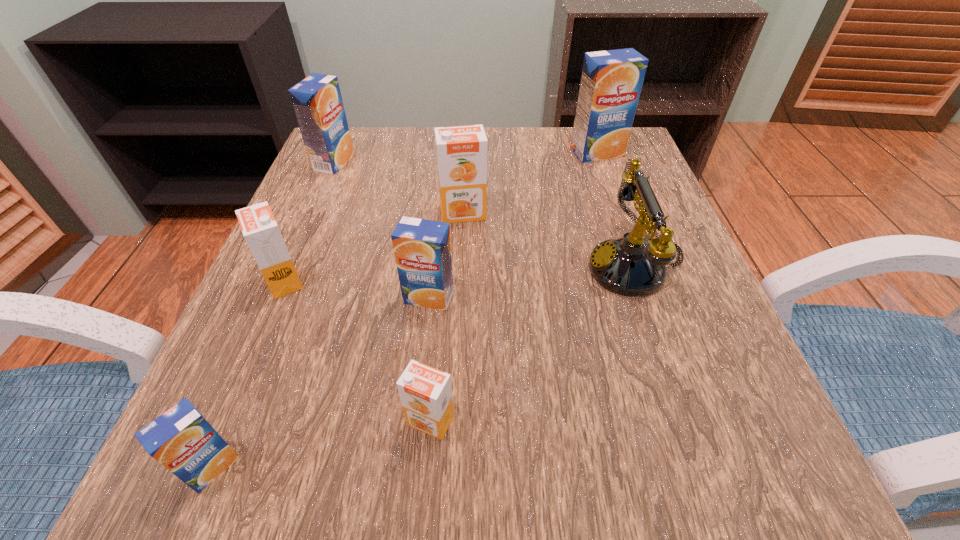
This screenshot has height=540, width=960. Find the location of `the smallest orange orange juice`. the smallest orange orange juice is located at coordinates (425, 392).

Where is `the nearest blue orange_juice`? the nearest blue orange_juice is located at coordinates (181, 439).

Locate an element on the screen. This screenshot has height=540, width=960. vacant area located on the left of the rightmost orange_juice is located at coordinates (511, 152).

The width and height of the screenshot is (960, 540). In order to click on vacant space located on the right of the third smallest blue orange_juice in this screenshot , I will do `click(501, 162)`.

Find the location of a particular element. vacant space located on the left of the farthest orange orange juice is located at coordinates (379, 213).

In order to click on vacant space located 0.360m on the dial of the telephone in this screenshot , I will do `click(381, 267)`.

Find the location of a particular element. vacant space located on the dial of the telephone is located at coordinates pos(364,267).

You are a GUI agent. You are given a task and a screenshot of the screen. Output one action in this format:
    pyautogui.click(x=<x>, y=<y>)
    Task: Click on the vacant space situated 0.280m on the dial of the telephone
    This screenshot has width=960, height=540.
    Given the screenshot: What is the action you would take?
    427,267

Find the location of a particular element. This screenshot has width=960, height=540. vacant space situated 0.400m on the right of the second nearest blue orange_juice is located at coordinates (699, 298).

This screenshot has height=540, width=960. I want to click on vacant space located 0.200m on the right of the second nearest orange orange juice, so point(425,281).